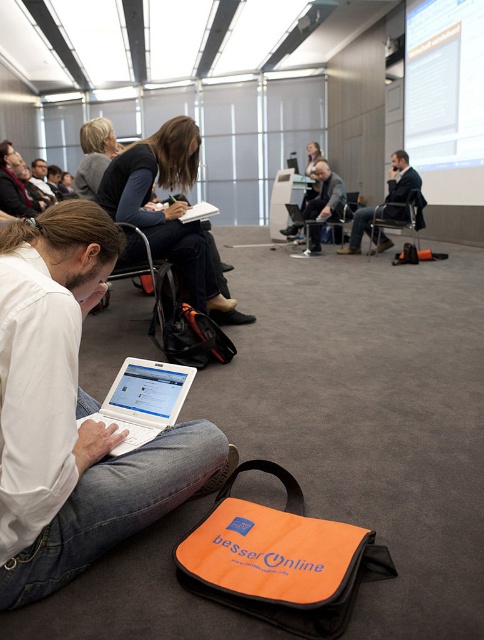
Is matte black jacket at upper left shorter than matte black laptop at left?

Indeed, matte black jacket at upper left has a lesser height compared to matte black laptop at left.

Image resolution: width=484 pixels, height=640 pixels. What do you see at coordinates (13, 184) in the screenshot? I see `matte black jacket at upper left` at bounding box center [13, 184].

The width and height of the screenshot is (484, 640). I want to click on matte black jacket at upper left, so click(x=13, y=184).

Does matte black jacket at center appear over matte black laptop at center?

No.

Is the position of matte black jacket at center more distant than that of matte black laptop at center?

No, it is in front of matte black laptop at center.

Which is behind, point (125, 253) or point (337, 188)?

The point (337, 188) is more distant.

You are a GUI agent. You are given a task and a screenshot of the screen. Output one action in this format:
    pyautogui.click(x=<x>, y=<y>)
    Task: Click on the matte black jacket at center
    This screenshot has width=484, height=640.
    Given the screenshot: What is the action you would take?
    pyautogui.click(x=169, y=212)

Based on the photo, does dark suit jacket at center appear on the left side of matte black hair at upper left?

Incorrect, dark suit jacket at center is not on the left side of matte black hair at upper left.

Can you confirm if dark suit jacket at center is thinner than matte black hair at upper left?

No, dark suit jacket at center is not thinner than matte black hair at upper left.

Where is `dark suit jacket at center`? The width and height of the screenshot is (484, 640). dark suit jacket at center is located at coordinates [x=389, y=205].

At what (x,y) coordinates should I click in order to perform the action: click on dark suit jacket at center. Please return your answer as a coordinate pair (x, y). Looking at the image, I should click on (389, 205).